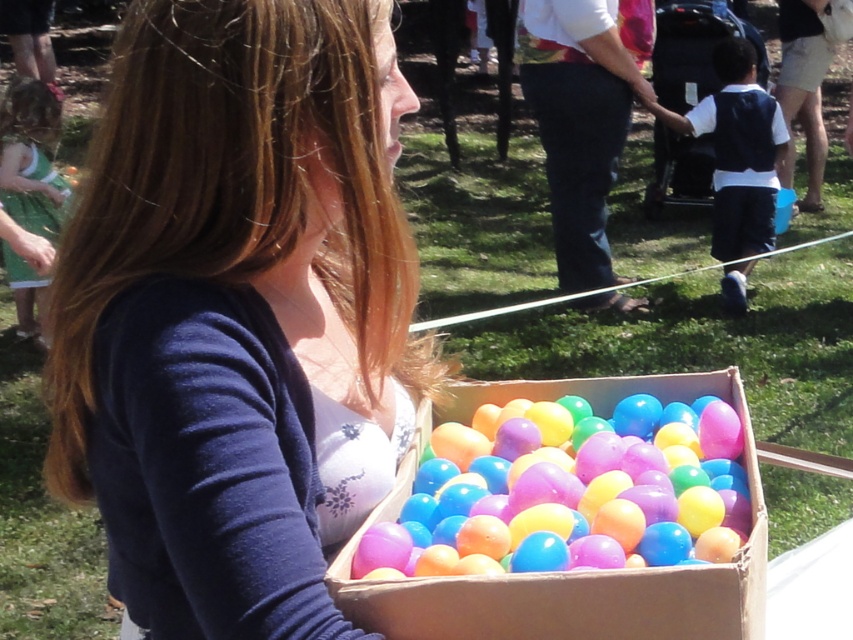
Question: Does translucent plastic eggs at center appear on the left side of denim pants at center?

Choices:
 (A) no
 (B) yes

Answer: (B)

Question: Among these points, which one is farthest from the camera?

Choices:
 (A) coord(566,417)
 (B) coord(529,60)
 (C) coord(759,182)

Answer: (C)

Question: Which point is farther from the camera taking this photo?

Choices:
 (A) click(x=564, y=36)
 (B) click(x=45, y=298)

Answer: (B)

Question: Among these points, which one is farthest from the camera?

Choices:
 (A) (625, 83)
 (B) (752, 134)
 (C) (27, 221)

Answer: (B)

Question: Is the position of white cotton shirt at right less distant than that of green cotton dress at left?

Choices:
 (A) yes
 (B) no

Answer: (B)

Question: From the image, what is the correct spatial relationship of translucent plastic eggs at center in relation to white cotton shirt at right?

Choices:
 (A) above
 (B) below

Answer: (B)